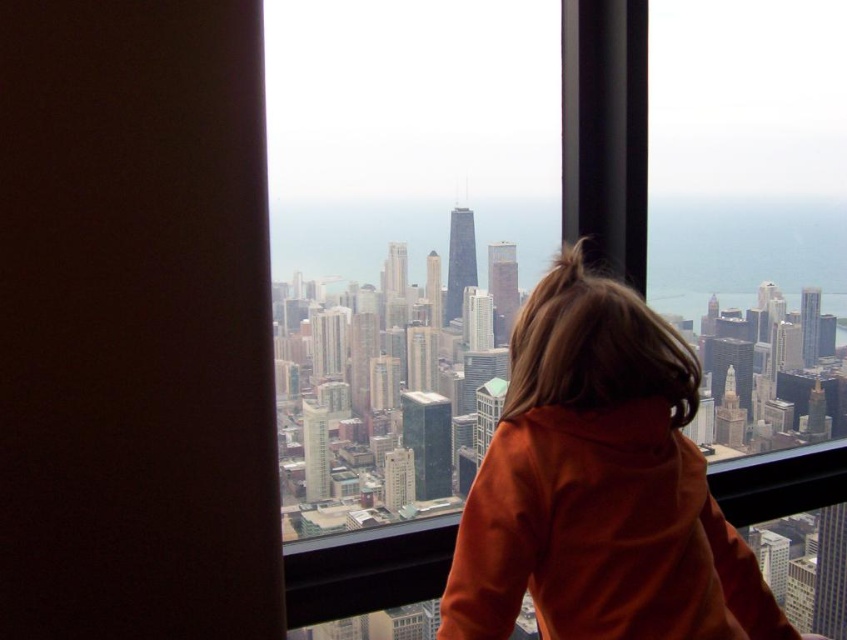
Does transparent glass window at center have a larger size compared to orange fleece at center?

Yes, transparent glass window at center is bigger than orange fleece at center.

Can you confirm if transparent glass window at center is taller than orange fleece at center?

Yes.

Who is more distant from viewer, (385, 129) or (464, 580)?

The point (385, 129) is behind.

Locate an element on the screen. This screenshot has height=640, width=847. transparent glass window at center is located at coordinates pos(540,257).